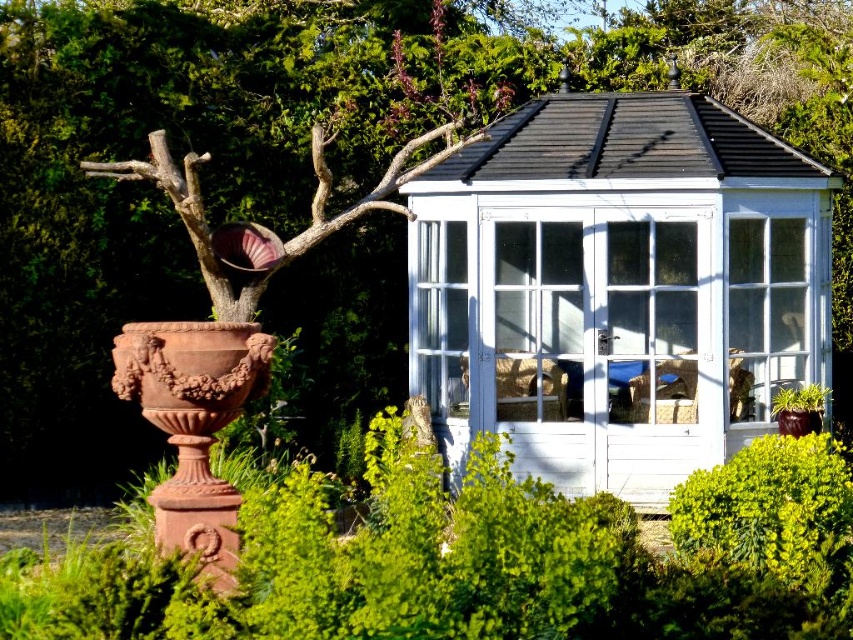
Question: Can you confirm if white painted wood gazebo at center is wider than clear glass door at center?

Choices:
 (A) no
 (B) yes

Answer: (B)

Question: Which object appears closest to the camera in this image?

Choices:
 (A) white painted wood gazebo at center
 (B) clear glass door at center

Answer: (A)

Question: In this image, where is white painted wood gazebo at center located relative to clear glass door at center?

Choices:
 (A) above
 (B) below

Answer: (A)

Question: From the image, what is the correct spatial relationship of white painted wood gazebo at center in relation to clear glass door at center?

Choices:
 (A) below
 (B) above

Answer: (B)

Question: Among these objects, which one is farthest from the camera?

Choices:
 (A) white painted wood gazebo at center
 (B) clear glass door at center

Answer: (B)